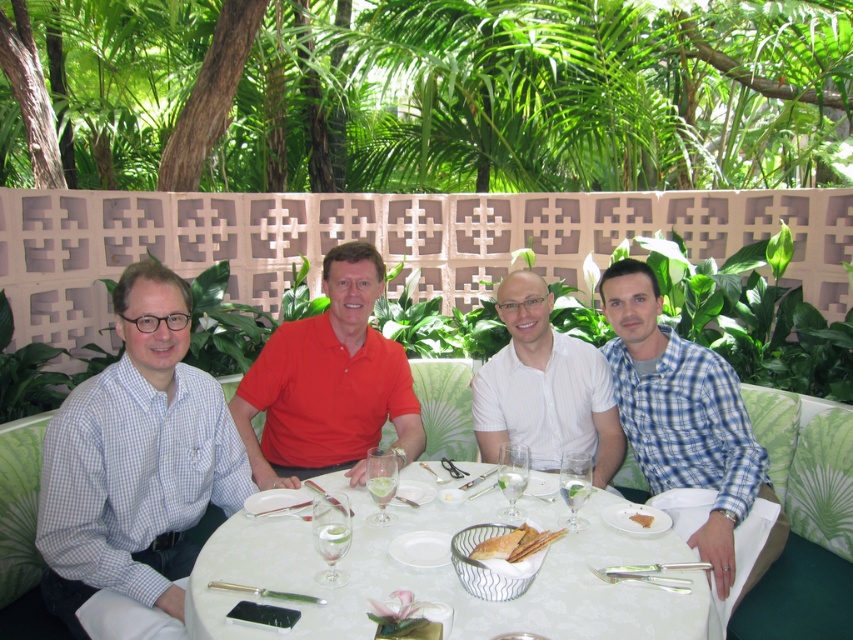
Which of these two, blue checkered shirt at left or blue plaid shirt at right, stands taller?

blue plaid shirt at right is taller.

Is point (83, 564) less distant than point (653, 360)?

Yes, it is in front of point (653, 360).

Between point (222, 486) and point (614, 388), which one is positioned in front?

Point (222, 486)

This screenshot has width=853, height=640. Find the location of `blue checkered shirt at left`. blue checkered shirt at left is located at coordinates (136, 460).

Which of these two, white cracker at center or golden brown bread at center, stands taller?

white cracker at center is taller.

Is white cracker at center below golden brown bread at center?

Indeed, white cracker at center is positioned under golden brown bread at center.

The height and width of the screenshot is (640, 853). Identify the location of white cracker at center. (514, 545).

Is point (744, 449) farther from camera compared to point (643, 522)?

Yes, point (744, 449) is farther from viewer.

Does blue plaid shirt at right have a lesser width compared to yellowish matte bread at lower right?

In fact, blue plaid shirt at right might be wider than yellowish matte bread at lower right.

The image size is (853, 640). Describe the element at coordinates (682, 412) in the screenshot. I see `blue plaid shirt at right` at that location.

Locate an element on the screen. Image resolution: width=853 pixels, height=640 pixels. blue plaid shirt at right is located at coordinates (682, 412).